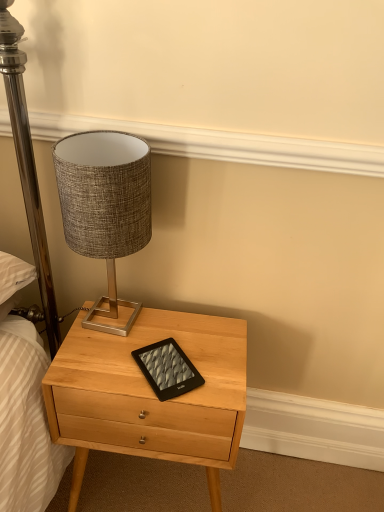
Find the location of `vacant area situated below textured fabric lampshade at upper left (from a real-world perspective)`. vacant area situated below textured fabric lampshade at upper left (from a real-world perspective) is located at coordinates (109, 321).